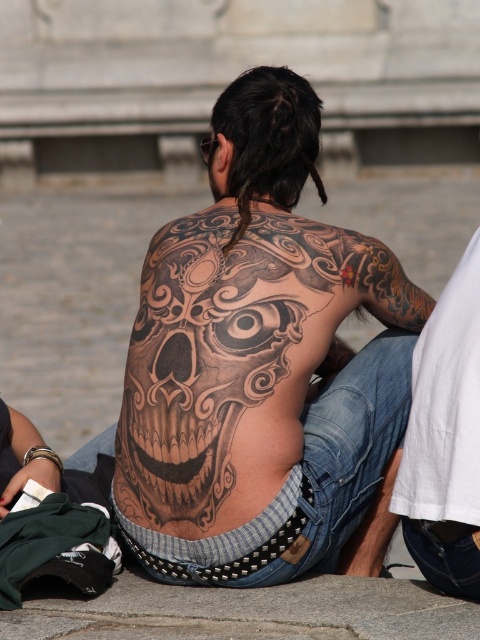
Does black tattooed skull at center appear on the left side of black tattooed skin at right?

Indeed, black tattooed skull at center is positioned on the left side of black tattooed skin at right.

Is black tattooed skull at center to the right of black tattooed skin at right from the viewer's perspective?

Incorrect, black tattooed skull at center is not on the right side of black tattooed skin at right.

Between point (215, 387) and point (460, 531), which one is positioned in front?

Point (460, 531) is in front.

Locate an element on the screen. The width and height of the screenshot is (480, 640). black tattooed skull at center is located at coordinates (259, 362).